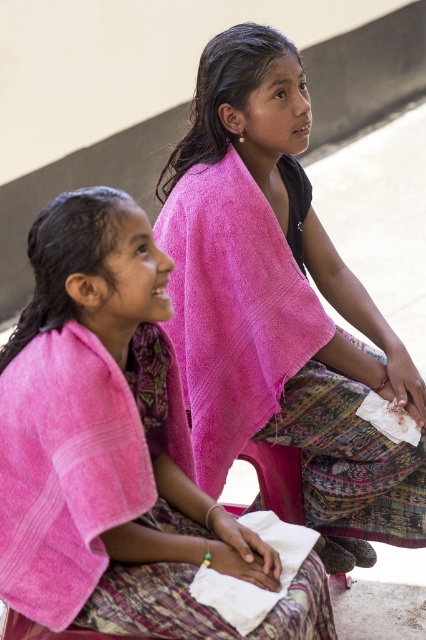
Where is the pink fabric at center located in the image?

The pink fabric at center is located at point (279, 310).

You are standing at the center of the image. There is a point at coordinates point (106, 440). What object is located at that point?

The pink towel at left is located at point (106, 440).